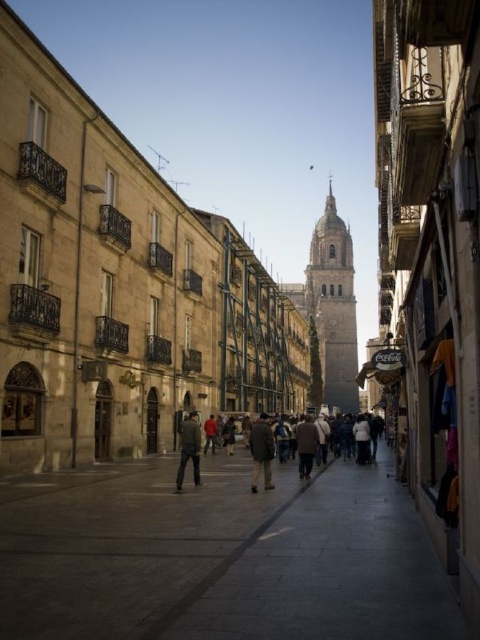
Question: Which point is closer to the camera taking this photo?

Choices:
 (A) (310, 445)
 (B) (177, 483)
 (C) (446, 620)

Answer: (C)

Question: Is dark gray stone pavement at center to the left of stone tower at center from the viewer's perspective?

Choices:
 (A) no
 (B) yes

Answer: (B)

Question: Considering the real-world distances, which object is farthest from the dark brown leather jacket at center?

Choices:
 (A) brown wool coat at center
 (B) stone tower at center
 (C) brown leather jacket at center

Answer: (B)

Question: Observing the image, what is the correct spatial positioning of brown wool coat at center in reference to dark gray jacket at center?

Choices:
 (A) below
 (B) above

Answer: (A)

Question: Is dark gray stone pavement at center bigger than stone tower at center?

Choices:
 (A) yes
 (B) no

Answer: (B)

Question: Which object is farther from the camera taking this photo?

Choices:
 (A) dark gray jacket at center
 (B) stone tower at center
 (C) dark gray stone pavement at center
 (D) brown leather jacket at center

Answer: (B)